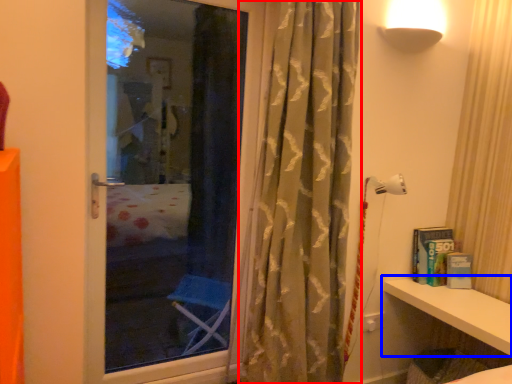
Question: Which object is closer to the camera taking this photo, curtain (highlighted by a red box) or shelf (highlighted by a blue box)?

Choices:
 (A) curtain
 (B) shelf

Answer: (A)